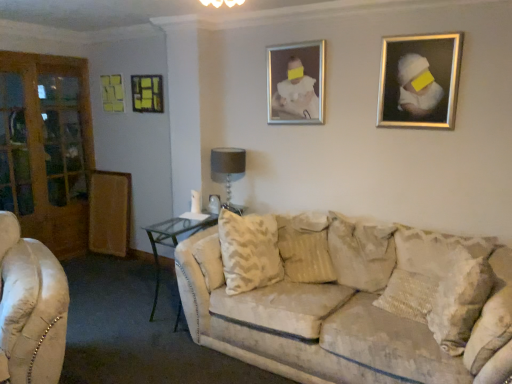
Question: Is gray fabric lampshade at center to the left or to the right of clear glass table at center in the image?

Choices:
 (A) right
 (B) left

Answer: (A)

Question: In terms of height, does gray fabric lampshade at center look taller or shorter compared to clear glass table at center?

Choices:
 (A) tall
 (B) short

Answer: (B)

Question: Estimate the real-world distances between objects in this image. Which object is farther from the beige textured pillow at center, the 3th pillow viewed from the right?

Choices:
 (A) silver metallic picture frame at upper center, marked as the 2th picture frame in a front-to-back arrangement
 (B) gray fabric lampshade at center
 (C) textured beige pillow at center, acting as the second pillow starting from the right
 (D) textured beige pillow at right, the 1th pillow in the right-to-left sequence
 (E) clear glass table at center

Answer: (A)

Question: Which object is the closest to the metallic silver picture frame at upper left, the 3th picture frame in the front-to-back sequence?

Choices:
 (A) gray fabric lampshade at center
 (B) textured beige pillow at center, acting as the second pillow starting from the right
 (C) textured beige pillow at right, which is counted as the third pillow, starting from the left
 (D) metallic silver picture frame at upper left, acting as the first picture frame starting from the left
 (E) clear glass table at center

Answer: (D)